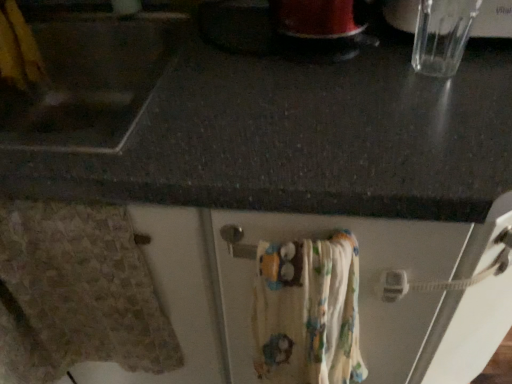
Describe the element at coordinates (308, 311) in the screenshot. I see `printed cotton bath towel at lower center, the second bath towel positioned from the left` at that location.

What is the approximate height of printed cotton bath towel at lower center, placed as the 1th bath towel when sorted from right to left?

printed cotton bath towel at lower center, placed as the 1th bath towel when sorted from right to left, is 14.83 inches tall.

This screenshot has height=384, width=512. Identify the location of printed cotton bath towel at lower center, the second bath towel positioned from the left. (308, 311).

Measure the distance between printed cotton bath towel at lower center, the second bath towel positioned from the left, and camera.

printed cotton bath towel at lower center, the second bath towel positioned from the left, and camera are 46.76 centimeters apart.

At what (x,y) coordinates should I click in order to perform the action: click on beige textured towel at lower left, the 1th bath towel positioned from the left. Please return your answer as a coordinate pair (x, y). Looking at the image, I should click on (76, 294).

Measure the distance between beige textured towel at lower left, the second bath towel in the right-to-left sequence, and camera.

The distance of beige textured towel at lower left, the second bath towel in the right-to-left sequence, from camera is 19.99 inches.

The width and height of the screenshot is (512, 384). Describe the element at coordinates (76, 294) in the screenshot. I see `beige textured towel at lower left, the 1th bath towel positioned from the left` at that location.

Where is `printed cotton bath towel at lower center, placed as the 1th bath towel when sorted from right to left`? The height and width of the screenshot is (384, 512). printed cotton bath towel at lower center, placed as the 1th bath towel when sorted from right to left is located at coordinates (308, 311).

Which object is positioned more to the left, beige textured towel at lower left, the second bath towel in the right-to-left sequence, or printed cotton bath towel at lower center, placed as the 1th bath towel when sorted from right to left?

Positioned to the left is beige textured towel at lower left, the second bath towel in the right-to-left sequence.

Who is more distant, beige textured towel at lower left, the second bath towel in the right-to-left sequence, or printed cotton bath towel at lower center, the second bath towel positioned from the left?

Positioned behind is beige textured towel at lower left, the second bath towel in the right-to-left sequence.

Does point (25, 286) come behind point (314, 338)?

Yes, point (25, 286) is farther from viewer.

Consider the image. From the image's perspective, which object appears higher, beige textured towel at lower left, the 1th bath towel positioned from the left, or printed cotton bath towel at lower center, placed as the 1th bath towel when sorted from right to left?

beige textured towel at lower left, the 1th bath towel positioned from the left, from the image's perspective.

From a real-world perspective, is beige textured towel at lower left, the second bath towel in the right-to-left sequence, physically above printed cotton bath towel at lower center, placed as the 1th bath towel when sorted from right to left?

No.

Looking at this image, considering the sizes of beige textured towel at lower left, the 1th bath towel positioned from the left, and printed cotton bath towel at lower center, placed as the 1th bath towel when sorted from right to left, in the image, is beige textured towel at lower left, the 1th bath towel positioned from the left, wider or thinner than printed cotton bath towel at lower center, placed as the 1th bath towel when sorted from right to left,?

Clearly, beige textured towel at lower left, the 1th bath towel positioned from the left, has less width compared to printed cotton bath towel at lower center, placed as the 1th bath towel when sorted from right to left.

Which of these two, beige textured towel at lower left, the second bath towel in the right-to-left sequence, or printed cotton bath towel at lower center, the second bath towel positioned from the left, stands taller?

With more height is beige textured towel at lower left, the second bath towel in the right-to-left sequence.

Who is bigger, beige textured towel at lower left, the 1th bath towel positioned from the left, or printed cotton bath towel at lower center, the second bath towel positioned from the left?

With larger size is printed cotton bath towel at lower center, the second bath towel positioned from the left.

Based on the photo, is beige textured towel at lower left, the 1th bath towel positioned from the left, spatially inside printed cotton bath towel at lower center, placed as the 1th bath towel when sorted from right to left, or outside of it?

beige textured towel at lower left, the 1th bath towel positioned from the left, exists outside the volume of printed cotton bath towel at lower center, placed as the 1th bath towel when sorted from right to left.

Can you see beige textured towel at lower left, the second bath towel in the right-to-left sequence, touching printed cotton bath towel at lower center, placed as the 1th bath towel when sorted from right to left?

No, beige textured towel at lower left, the second bath towel in the right-to-left sequence, is not with printed cotton bath towel at lower center, placed as the 1th bath towel when sorted from right to left.

Is beige textured towel at lower left, the second bath towel in the right-to-left sequence, facing towards printed cotton bath towel at lower center, the second bath towel positioned from the left?

No, beige textured towel at lower left, the second bath towel in the right-to-left sequence, does not turn towards printed cotton bath towel at lower center, the second bath towel positioned from the left.

How many degrees apart are the facing directions of beige textured towel at lower left, the second bath towel in the right-to-left sequence, and printed cotton bath towel at lower center, the second bath towel positioned from the left?

There is a 0.00167-degree angle between the facing directions of beige textured towel at lower left, the second bath towel in the right-to-left sequence, and printed cotton bath towel at lower center, the second bath towel positioned from the left.

Measure the distance from beige textured towel at lower left, the second bath towel in the right-to-left sequence, to printed cotton bath towel at lower center, placed as the 1th bath towel when sorted from right to left.

They are 9.92 inches apart.

Find the location of a particular element. Image resolution: width=512 pixels, height=384 pixels. bath towel on the left of printed cotton bath towel at lower center, placed as the 1th bath towel when sorted from right to left is located at coordinates (76, 294).

Can you confirm if printed cotton bath towel at lower center, the second bath towel positioned from the left, is positioned to the right of beige textured towel at lower left, the 1th bath towel positioned from the left?

Indeed, printed cotton bath towel at lower center, the second bath towel positioned from the left, is positioned on the right side of beige textured towel at lower left, the 1th bath towel positioned from the left.

Considering the positions of objects printed cotton bath towel at lower center, the second bath towel positioned from the left, and beige textured towel at lower left, the second bath towel in the right-to-left sequence, in the image provided, who is behind, printed cotton bath towel at lower center, the second bath towel positioned from the left, or beige textured towel at lower left, the second bath towel in the right-to-left sequence,?

beige textured towel at lower left, the second bath towel in the right-to-left sequence, is behind.

Which point is more forward, (274, 280) or (37, 271)?

Point (274, 280)

From the image's perspective, is printed cotton bath towel at lower center, the second bath towel positioned from the left, beneath beige textured towel at lower left, the second bath towel in the right-to-left sequence?

Indeed, from the image's perspective, printed cotton bath towel at lower center, the second bath towel positioned from the left, is shown beneath beige textured towel at lower left, the second bath towel in the right-to-left sequence.

From a real-world perspective, between printed cotton bath towel at lower center, placed as the 1th bath towel when sorted from right to left, and beige textured towel at lower left, the 1th bath towel positioned from the left, who is vertically lower?

In real-world perspective, beige textured towel at lower left, the 1th bath towel positioned from the left, is lower.

Which object is thinner, printed cotton bath towel at lower center, the second bath towel positioned from the left, or beige textured towel at lower left, the 1th bath towel positioned from the left?

beige textured towel at lower left, the 1th bath towel positioned from the left, is thinner.

Looking at this image, which of these two, printed cotton bath towel at lower center, the second bath towel positioned from the left, or beige textured towel at lower left, the second bath towel in the right-to-left sequence, stands shorter?

Standing shorter between the two is printed cotton bath towel at lower center, the second bath towel positioned from the left.

Is printed cotton bath towel at lower center, placed as the 1th bath towel when sorted from right to left, smaller than beige textured towel at lower left, the second bath towel in the right-to-left sequence?

Actually, printed cotton bath towel at lower center, placed as the 1th bath towel when sorted from right to left, might be larger than beige textured towel at lower left, the second bath towel in the right-to-left sequence.

Is printed cotton bath towel at lower center, placed as the 1th bath towel when sorted from right to left, inside the boundaries of beige textured towel at lower left, the 1th bath towel positioned from the left, or outside?

printed cotton bath towel at lower center, placed as the 1th bath towel when sorted from right to left, cannot be found inside beige textured towel at lower left, the 1th bath towel positioned from the left.

Is printed cotton bath towel at lower center, the second bath towel positioned from the left, next to beige textured towel at lower left, the 1th bath towel positioned from the left, and touching it?

printed cotton bath towel at lower center, the second bath towel positioned from the left, is not next to beige textured towel at lower left, the 1th bath towel positioned from the left, and they're not touching.

Does printed cotton bath towel at lower center, placed as the 1th bath towel when sorted from right to left, turn towards beige textured towel at lower left, the 1th bath towel positioned from the left?

No, printed cotton bath towel at lower center, placed as the 1th bath towel when sorted from right to left, is not turned towards beige textured towel at lower left, the 1th bath towel positioned from the left.

How different are the orientations of printed cotton bath towel at lower center, placed as the 1th bath towel when sorted from right to left, and beige textured towel at lower left, the 1th bath towel positioned from the left, in degrees?

0.00167 degrees.

In the image, there is a printed cotton bath towel at lower center, placed as the 1th bath towel when sorted from right to left. At what (x,y) coordinates should I click in order to perform the action: click on bath towel above it (from the image's perspective). Please return your answer as a coordinate pair (x, y). This screenshot has width=512, height=384. Looking at the image, I should click on (76, 294).

Locate an element on the screen. The width and height of the screenshot is (512, 384). bath towel that is behind the printed cotton bath towel at lower center, the second bath towel positioned from the left is located at coordinates (76, 294).

In order to click on bath towel above the beige textured towel at lower left, the second bath towel in the right-to-left sequence (from a real-world perspective) in this screenshot , I will do pos(308,311).